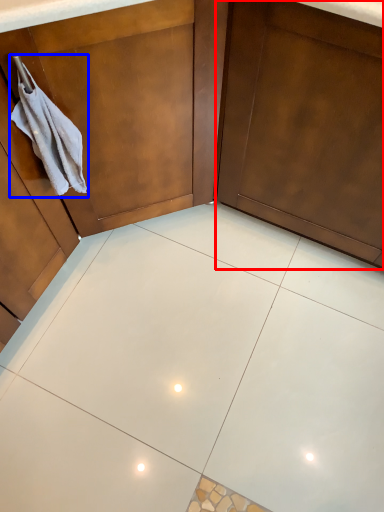
Question: Among these objects, which one is nearest to the camera, door (highlighted by a red box) or hand towel (highlighted by a blue box)?

Choices:
 (A) door
 (B) hand towel

Answer: (A)